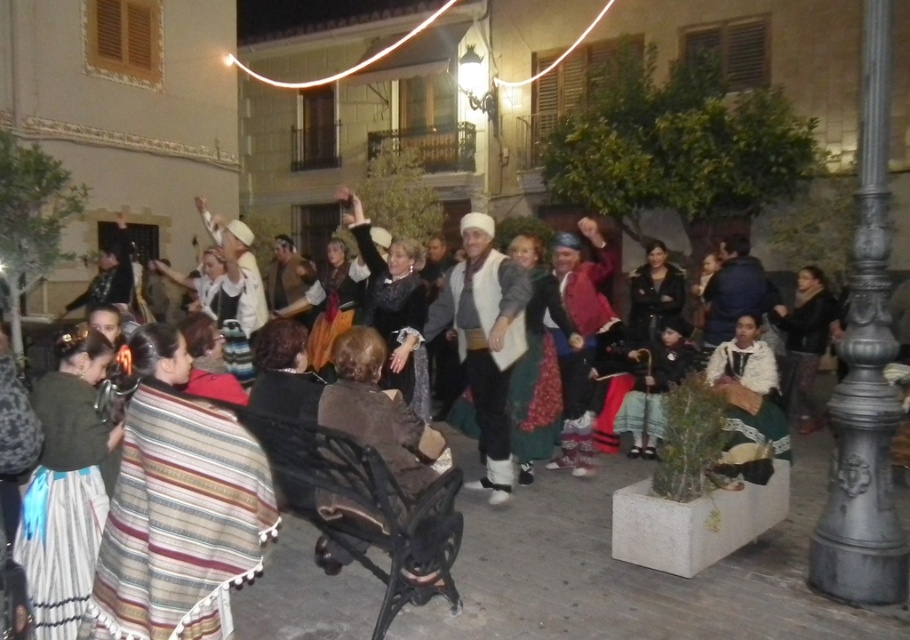
Consider the image. What is located at the coordinates point (484, 340) in the image?

The white woolen sweater at center is located at point (484, 340).